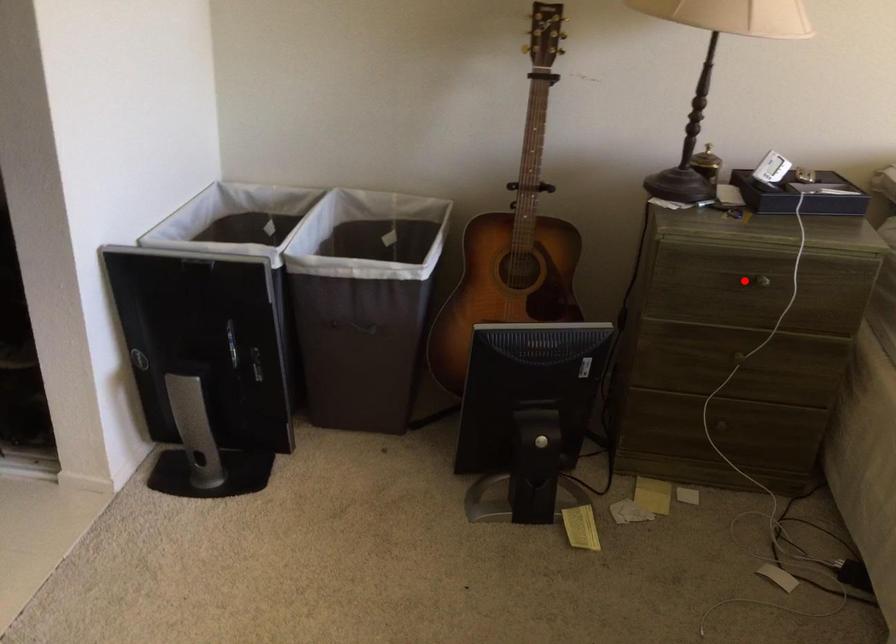
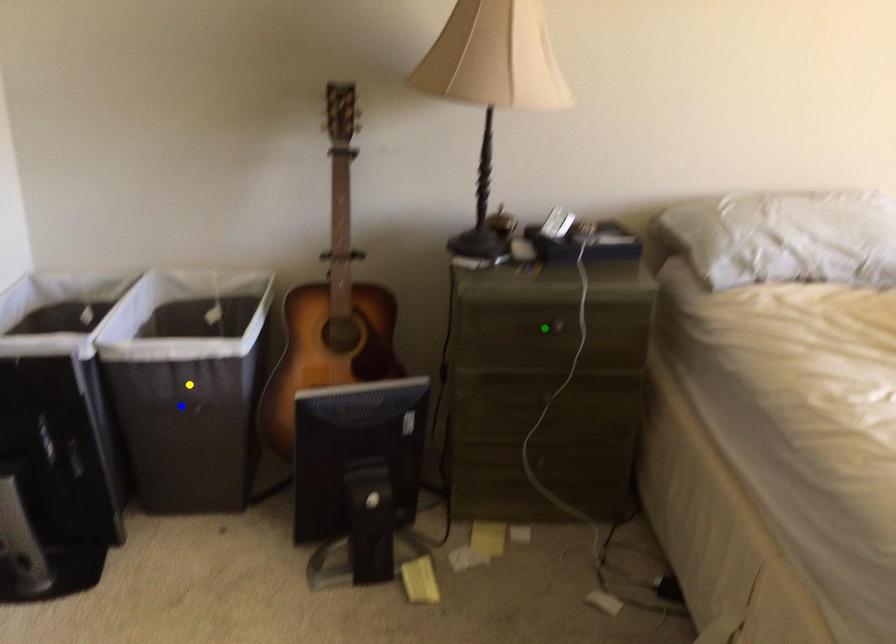
Question: I am providing you with two images of the same scene from different viewpoints. A red point is marked on the first image. You are given multiple points on the second image. Can you choose the point in image 2 that corresponds to the point in image 1?

Choices:
 (A) blue point
 (B) green point
 (C) yellow point

Answer: (B)